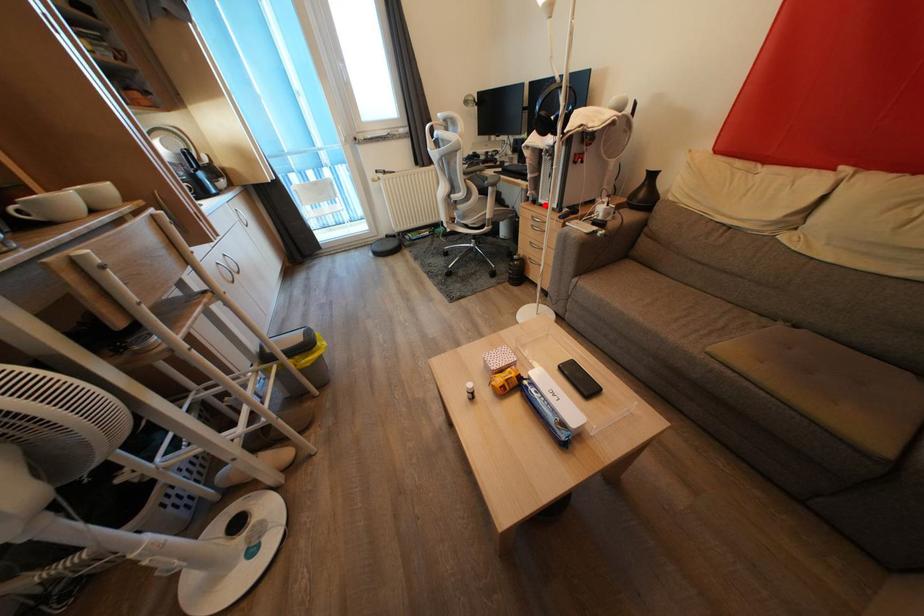
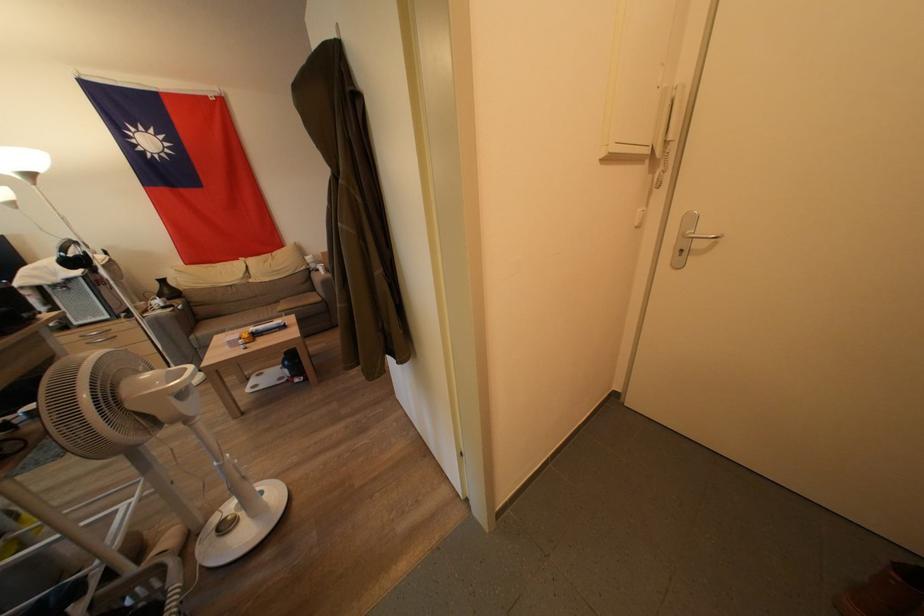
Locate, in the second image, the point that corresponds to the highlighted location in the first image.

(81, 328)